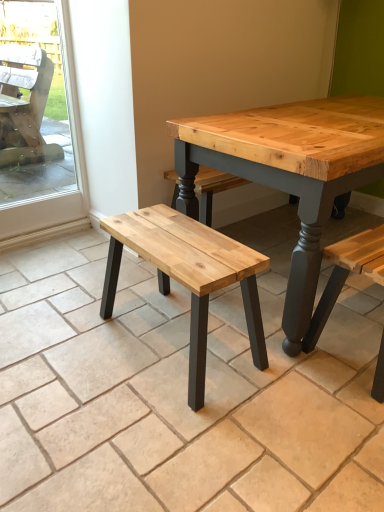
Question: From the image's perspective, relative to natural wood bench at center, is transparent glass screen door at left above or below?

Choices:
 (A) below
 (B) above

Answer: (B)

Question: Which is correct: transparent glass screen door at left is inside natural wood bench at center, or outside of it?

Choices:
 (A) inside
 (B) outside

Answer: (B)

Question: Estimate the real-world distances between objects in this image. Which object is farther from the natural wood bench at center?

Choices:
 (A) natural wood bench at center
 (B) transparent glass screen door at left

Answer: (B)

Question: Which is farther from the transparent glass screen door at left?

Choices:
 (A) natural wood bench at center
 (B) natural wood bench at center

Answer: (A)